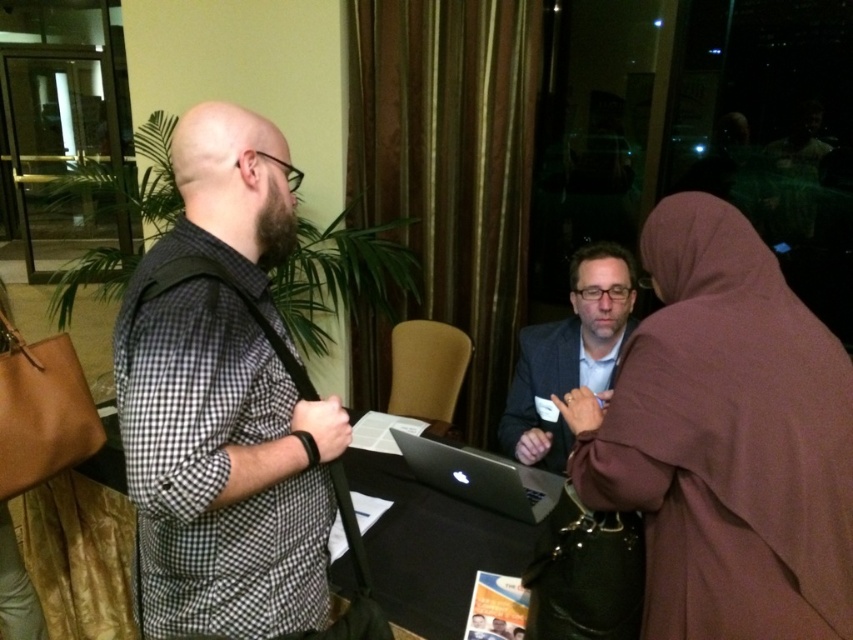
Question: Is brown fabric robe at right positioned before checkered fabric shirt at left?

Choices:
 (A) no
 (B) yes

Answer: (A)

Question: Which of the following is the closest to the observer?

Choices:
 (A) silver metallic laptop at center
 (B) brown fabric robe at right
 (C) matte black suit at center
 (D) checkered fabric shirt at left

Answer: (D)

Question: Which point is farther to the camera?

Choices:
 (A) silver metallic laptop at center
 (B) brown fabric robe at right

Answer: (A)

Question: Estimate the real-world distances between objects in this image. Which object is closer to the checkered fabric shirt at left?

Choices:
 (A) silver metallic laptop at center
 (B) brown fabric robe at right

Answer: (B)

Question: Can you confirm if checkered fabric shirt at left is thinner than silver metallic laptop at center?

Choices:
 (A) yes
 (B) no

Answer: (A)

Question: Can you confirm if brown fabric robe at right is positioned to the right of silver metallic laptop at center?

Choices:
 (A) no
 (B) yes

Answer: (B)